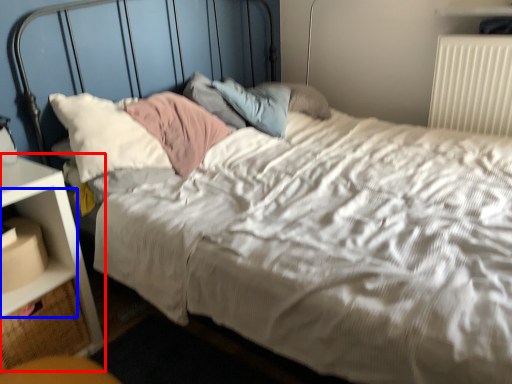
Question: Which point is further to the camera, nightstand (highlighted by a red box) or shelf (highlighted by a blue box)?

Choices:
 (A) nightstand
 (B) shelf

Answer: (B)